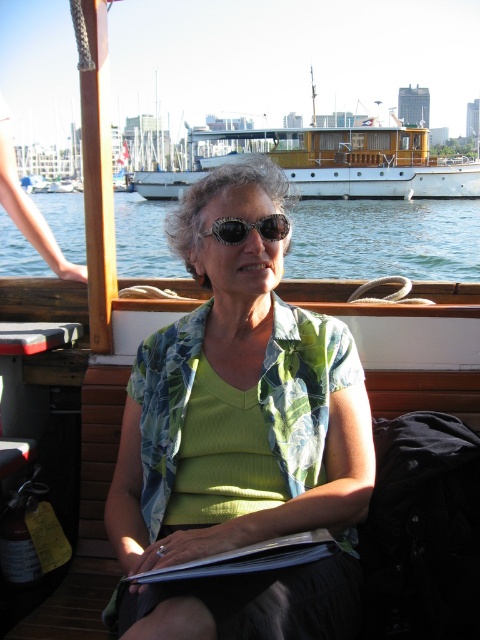
You are a passenger on the boat and want to take a photo of the blue water at center without the wooden polished boat at upper center blocking the view. Is this possible?

The blue water at center is positioned under the wooden polished boat at upper center, so taking a photo of the blue water at center without the boat blocking the view would require positioning the camera below the boat, which might not be feasible from the passenger area.

You are a passenger on the boat and want to place your 10 inch long travel journal on the table between the green fabric shirt at center and the white paper book at center. Is there enough space?

The distance between the green fabric shirt at center and the white paper book at center is 8.03 inches, which is less than the 10 inch travel journal. Therefore, there is not enough space to place the travel journal between them.